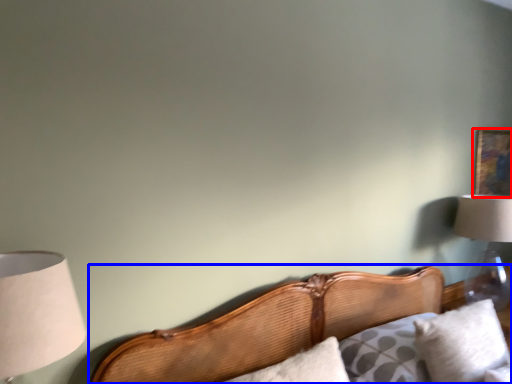
Question: Which object appears farthest to the camera in this image, picture frame (highlighted by a red box) or bed (highlighted by a blue box)?

Choices:
 (A) picture frame
 (B) bed

Answer: (A)